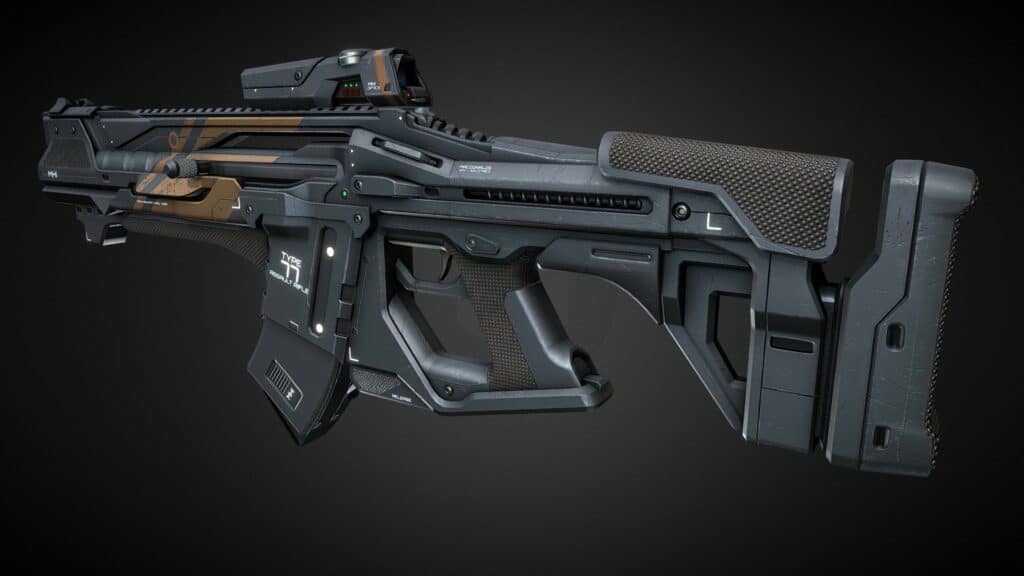
Where is `magzine`? magzine is located at coordinates (317, 386).